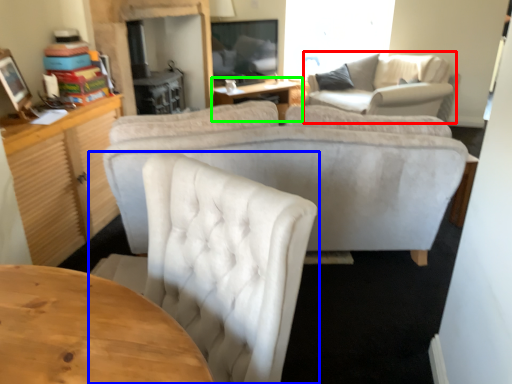
Question: Based on their relative distances, which object is farther from couch (highlighted by a red box)? Choose from chair (highlighted by a blue box) and table (highlighted by a green box).

Choices:
 (A) chair
 (B) table

Answer: (A)